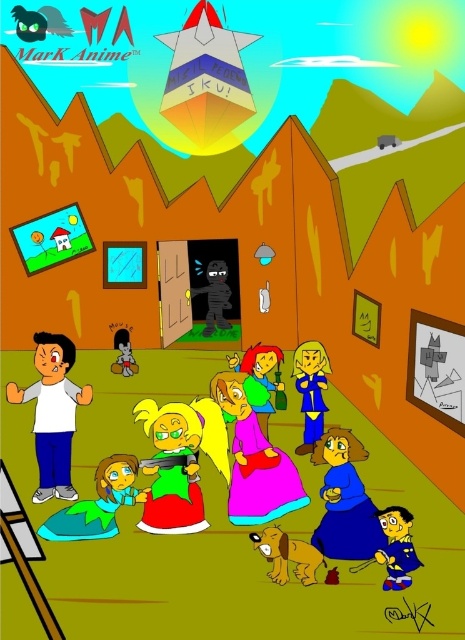
Question: Which point appears closest to the camera in this image?

Choices:
 (A) (366, 509)
 (B) (263, 428)
 (C) (110, 465)

Answer: (A)

Question: Based on their relative distances, which object is nearer to the green fabric dress at center?

Choices:
 (A) shiny black figure at center
 (B) teal fabric dress at lower left
 (C) matte white shirt at lower left

Answer: (B)

Question: Does metallic silver pyramid at center come in front of silky pink dress at center?

Choices:
 (A) yes
 (B) no

Answer: (B)

Question: Does matte white shirt at lower left have a smaller size compared to blue fabric dress at center?

Choices:
 (A) no
 (B) yes

Answer: (A)

Question: Which of the following is the farthest from the observer?

Choices:
 (A) (389, 566)
 (B) (134, 364)
 (C) (313, 342)

Answer: (B)

Question: Can you confirm if green fabric dress at center is positioned to the right of matte white shirt at lower left?

Choices:
 (A) no
 (B) yes

Answer: (B)